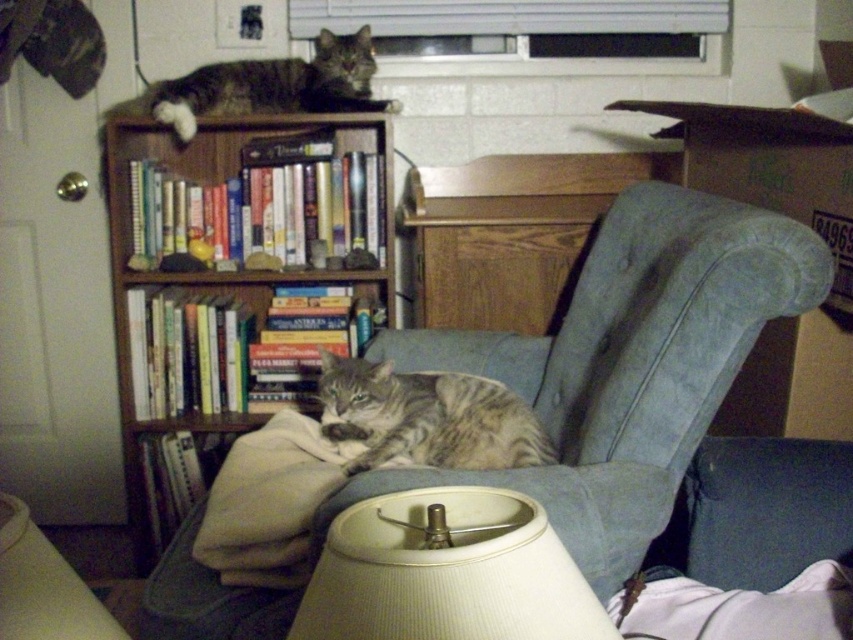
You are a cat owner trying to place a new cat tree in the living room. The cat tree requires a space of 1 meter in width. You see the wooden bookshelf at upper left. Is there enough space next to it for the cat tree?

The wooden bookshelf at upper left is located at point (x=213, y=269). However, without knowing the dimensions of the space or the bookshelf itself, it is impossible to determine if there is enough room for the cat tree. Please consult the room measurements or the bookshelf dimensions for accurate placement.

You are a cat owner trying to place a new cat tree in the living room. The cat tree is 1.2 meters wide. You want to place it between the velvet blue armchair at center and the wooden bookshelf at upper left. Is there enough space?

The velvet blue armchair at center is to the right of the wooden bookshelf at upper left, but the exact distance between them isn